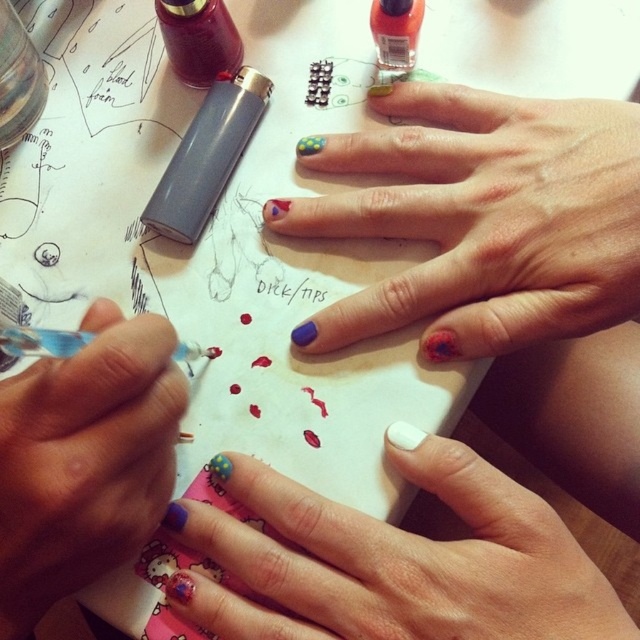
Question: Based on their relative distances, which object is farther from the blue matte nail polish at center?

Choices:
 (A) matte blue nail polish at center
 (B) neon orange glass nail polish at upper center

Answer: (B)

Question: Can you confirm if multicolored painted nails at center is wider than matte blue nail polish at center?

Choices:
 (A) no
 (B) yes

Answer: (A)

Question: Is multicolored painted nails at center closer to the viewer compared to neon orange glass nail polish at upper center?

Choices:
 (A) no
 (B) yes

Answer: (B)

Question: Does multicolored painted nails at center appear on the right side of neon orange glass nail polish at upper center?

Choices:
 (A) no
 (B) yes

Answer: (B)

Question: Which of the following is the closest to the observer?

Choices:
 (A) multicolored painted nails at center
 (B) neon orange glass nail polish at upper center
 (C) blue matte nail polish at center
 (D) matte blue nail polish at center

Answer: (C)

Question: Based on their relative distances, which object is nearer to the blue matte nail polish at center?

Choices:
 (A) matte blue nail polish at center
 (B) multicolored painted nails at center
 (C) neon orange glass nail polish at upper center

Answer: (A)